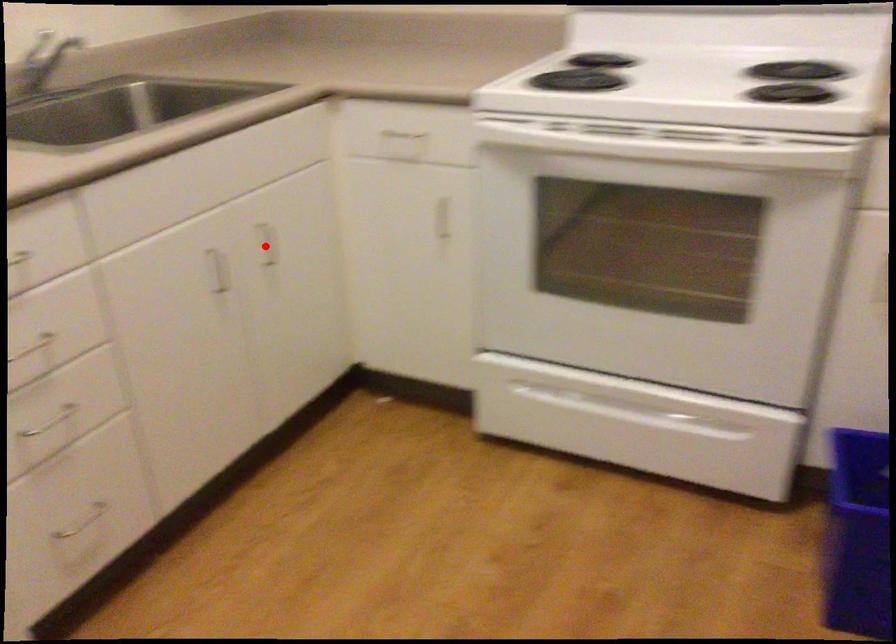
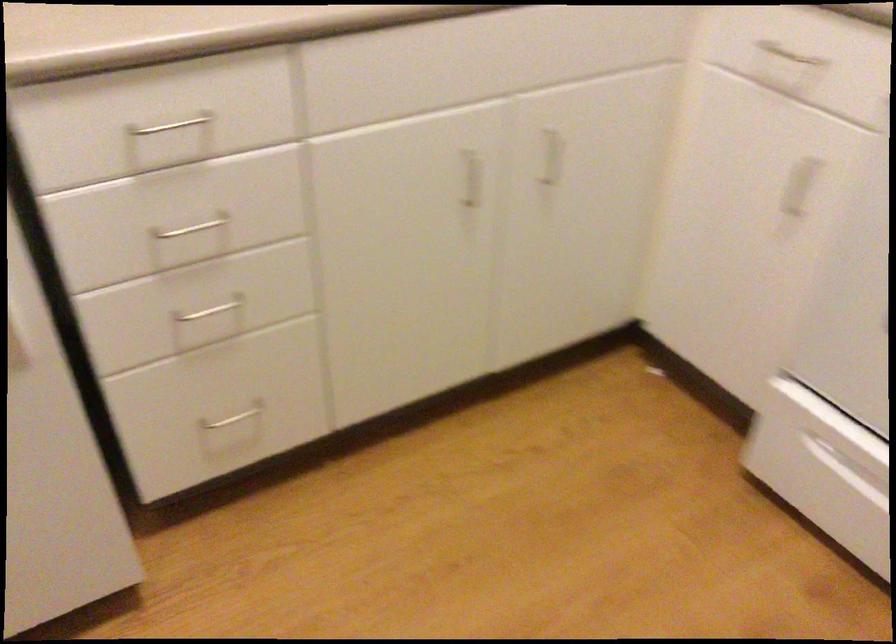
Question: I am providing you with two images of the same scene from different viewpoints. In image1, a red point is highlighted. Considering the same 3D point in image2, which of the following is correct?

Choices:
 (A) It is closer
 (B) It is farther

Answer: (A)